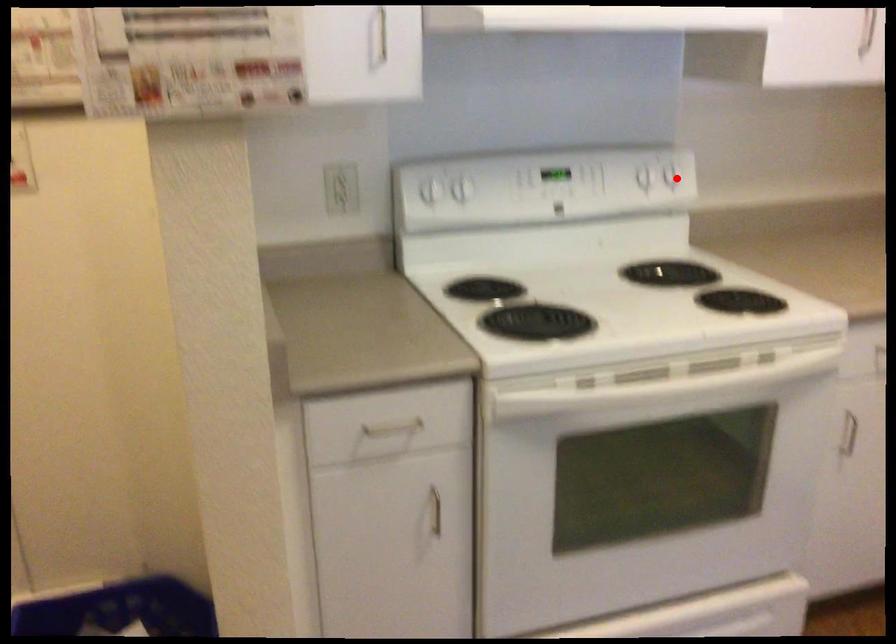
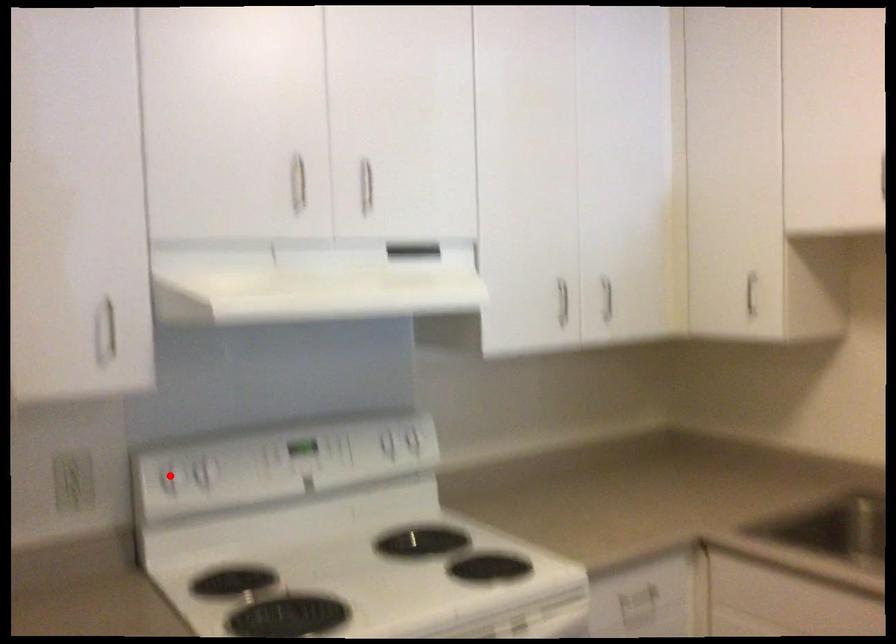
I am providing you with two images of the same scene from different viewpoints. A red point is marked on the first image and another point is marked on the second image. Is the marked point in image1 the same physical position as the marked point in image2?

No